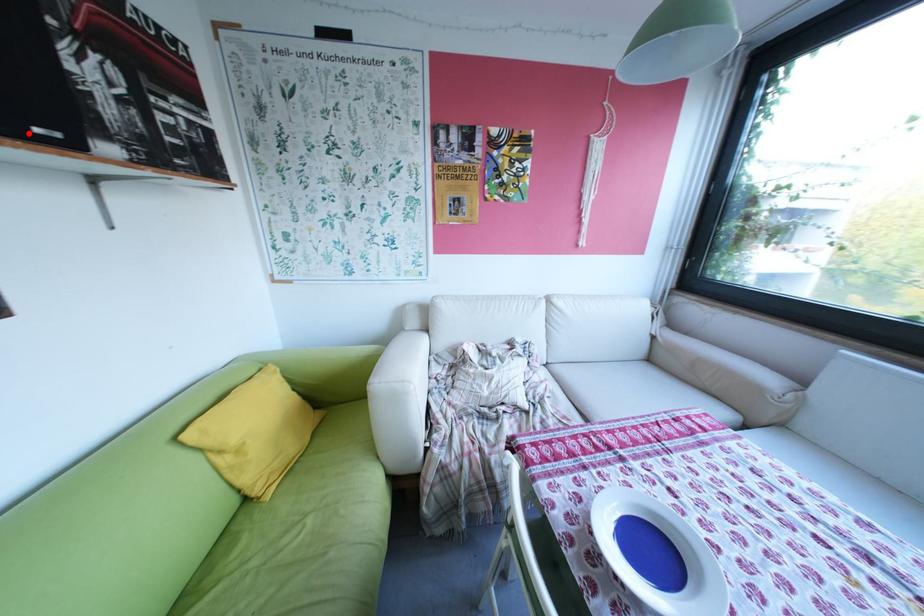
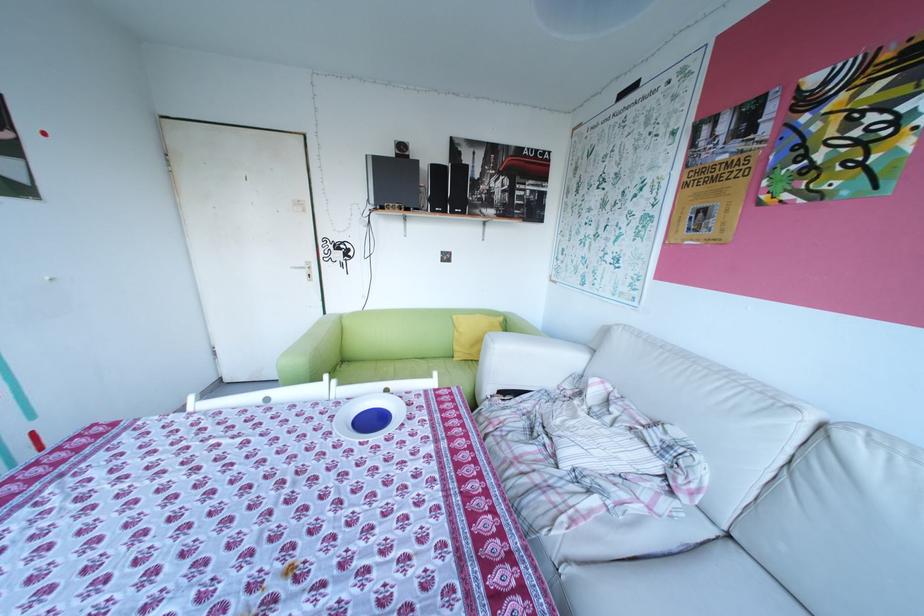
Question: I am providing you with two images of the same scene from different viewpoints. A red point is marked on the first image. Can you still see the location of the red point in image 2?

Choices:
 (A) Yes
 (B) No

Answer: (A)